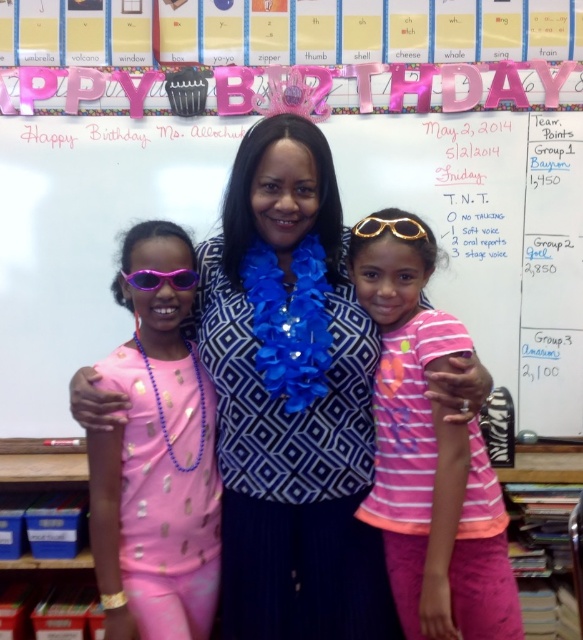
You are a photographer trying to capture the birthday girl in the center. The gold metallic goggles at center and the pink paper banner at upper center are blocking your view. Which object is closer to you so you can adjust your angle?

The pink paper banner at upper center is closer to you because the gold metallic goggles at center is behind it, so you should adjust your angle to avoid the banner first.

You are a photographer trying to capture a closeup of the pink shiny sunglasses at left. Based on the coordinates provided, which direction should you move your camera to focus on the sunglasses?

The pink shiny sunglasses at left are located at coordinates point (157, 477). To focus on them, move the camera to the right and slightly downward.